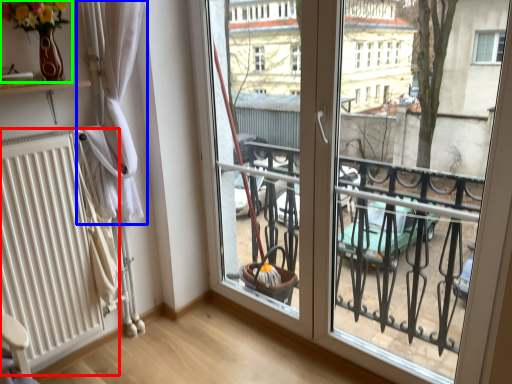
Question: Considering the real-world distances, which object is farthest from radiator (highlighted by a red box)? curtain (highlighted by a blue box) or floral arrangement (highlighted by a green box)?

Choices:
 (A) curtain
 (B) floral arrangement

Answer: (B)